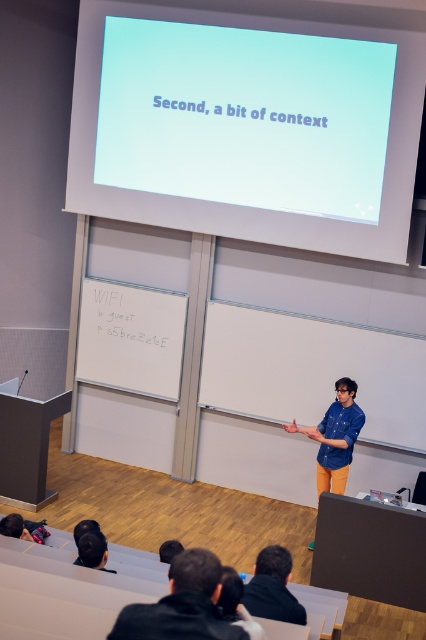
Does denim shirt at center have a smaller size compared to black fabric jacket at lower center?

No, denim shirt at center is not smaller than black fabric jacket at lower center.

Is denim shirt at center positioned at the back of black fabric jacket at lower center?

Yes, it is.

Is point (362, 412) positioned behind point (261, 602)?

Yes, it is behind point (261, 602).

Where is `denim shirt at center`? The height and width of the screenshot is (640, 426). denim shirt at center is located at coordinates 334,436.

Does white glossy projection screen at upper center appear on the left side of denim shirt at center?

Yes, white glossy projection screen at upper center is to the left of denim shirt at center.

Who is higher up, white glossy projection screen at upper center or denim shirt at center?

white glossy projection screen at upper center is above.

At what (x,y) coordinates should I click in order to perform the action: click on white glossy projection screen at upper center. Please return your answer as a coordinate pair (x, y). Looking at the image, I should click on (250, 122).

Is point (83, 204) closer to camera compared to point (127, 616)?

That is False.

Between white glossy projection screen at upper center and denim jacket at lower center, which one has more height?

white glossy projection screen at upper center is taller.

The width and height of the screenshot is (426, 640). What are the coordinates of `white glossy projection screen at upper center` in the screenshot? It's located at (250, 122).